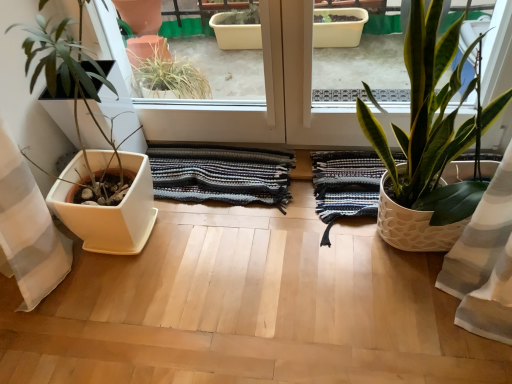
Question: Can you confirm if white textured pot at right, positioned as the 2th houseplant in left-to-right order, is shorter than white matte planter at left, placed as the second houseplant when sorted from right to left?

Choices:
 (A) yes
 (B) no

Answer: (A)

Question: From the image's perspective, is white textured pot at right, which is counted as the first houseplant, starting from the right, over white matte planter at left, placed as the second houseplant when sorted from right to left?

Choices:
 (A) no
 (B) yes

Answer: (A)

Question: Is white textured pot at right, positioned as the 2th houseplant in left-to-right order, looking in the opposite direction of white matte planter at left, arranged as the 1th houseplant when viewed from the left?

Choices:
 (A) no
 (B) yes

Answer: (A)

Question: Is white textured pot at right, which is counted as the first houseplant, starting from the right, located outside white matte planter at left, arranged as the 1th houseplant when viewed from the left?

Choices:
 (A) yes
 (B) no

Answer: (A)

Question: Can you confirm if white textured pot at right, which is counted as the first houseplant, starting from the right, is bigger than white matte planter at left, placed as the second houseplant when sorted from right to left?

Choices:
 (A) no
 (B) yes

Answer: (A)

Question: In terms of size, does white textured bath towel at right, which is the second bath towel in left-to-right order, appear bigger or smaller than striped cotton rug at center, the 1th bath towel viewed from the left?

Choices:
 (A) small
 (B) big

Answer: (B)

Question: From a real-world perspective, is white textured bath towel at right, the first bath towel in the right-to-left sequence, positioned above or below striped cotton rug at center, the 1th bath towel viewed from the left?

Choices:
 (A) below
 (B) above

Answer: (A)

Question: Do you think white textured bath towel at right, which is the second bath towel in left-to-right order, is within striped cotton rug at center, the 2th bath towel from the right, or outside of it?

Choices:
 (A) inside
 (B) outside

Answer: (B)

Question: From the image's perspective, is white textured bath towel at right, the first bath towel in the right-to-left sequence, above or below striped cotton rug at center, the 1th bath towel viewed from the left?

Choices:
 (A) above
 (B) below

Answer: (B)

Question: Choose the correct answer: Is striped cotton rug at center, the 2th bath towel from the right, inside white matte planter at left, arranged as the 1th houseplant when viewed from the left, or outside it?

Choices:
 (A) outside
 (B) inside

Answer: (A)

Question: Is striped cotton rug at center, the 1th bath towel viewed from the left, bigger or smaller than white matte planter at left, arranged as the 1th houseplant when viewed from the left?

Choices:
 (A) small
 (B) big

Answer: (A)

Question: Is point (227, 198) closer or farther from the camera than point (103, 140)?

Choices:
 (A) closer
 (B) farther

Answer: (B)

Question: From a real-world perspective, is striped cotton rug at center, the 1th bath towel viewed from the left, positioned above or below white matte planter at left, placed as the second houseplant when sorted from right to left?

Choices:
 (A) below
 (B) above

Answer: (A)

Question: Considering the positions of striped cotton rug at center, the 2th bath towel from the right, and white textured bath towel at right, which is the second bath towel in left-to-right order, in the image, is striped cotton rug at center, the 2th bath towel from the right, wider or thinner than white textured bath towel at right, which is the second bath towel in left-to-right order,?

Choices:
 (A) wide
 (B) thin

Answer: (B)

Question: From their relative heights in the image, would you say striped cotton rug at center, the 2th bath towel from the right, is taller or shorter than white textured bath towel at right, which is the second bath towel in left-to-right order?

Choices:
 (A) short
 (B) tall

Answer: (B)